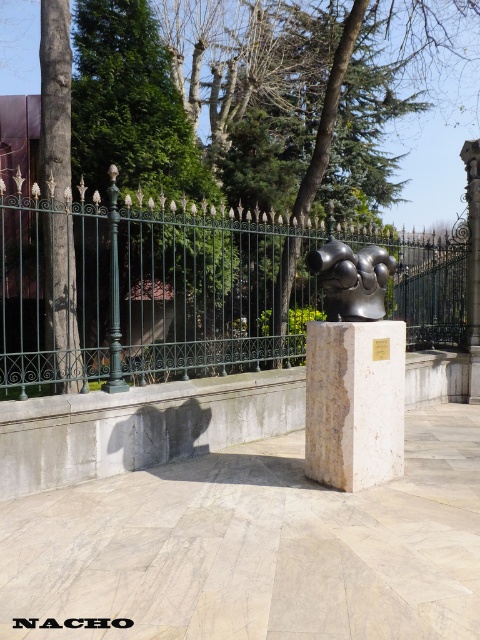
Looking at this image, which of these two, green wrought iron fence at center or white marble pillar at center, stands taller?

Standing taller between the two is white marble pillar at center.

How distant is green wrought iron fence at center from white marble pillar at center?

The distance of green wrought iron fence at center from white marble pillar at center is 1.73 meters.

Is point (192, 326) less distant than point (333, 337)?

No, it is not.

Image resolution: width=480 pixels, height=640 pixels. I want to click on green wrought iron fence at center, so click(149, 292).

Can you confirm if green wrought iron fence at center is wider than smooth bark tree at left?

Correct, the width of green wrought iron fence at center exceeds that of smooth bark tree at left.

Can you confirm if green wrought iron fence at center is positioned to the left of smooth bark tree at left?

No, green wrought iron fence at center is not to the left of smooth bark tree at left.

Between point (292, 323) and point (68, 342), which one is positioned in front?

Point (68, 342) is more forward.

Find the location of a particular element. The height and width of the screenshot is (640, 480). green wrought iron fence at center is located at coordinates (149, 292).

Is white marble pillar at center above smooth bark tree at left?

Actually, white marble pillar at center is below smooth bark tree at left.

How much distance is there between white marble pillar at center and smooth bark tree at left?

white marble pillar at center is 8.04 feet from smooth bark tree at left.

Between point (377, 340) and point (66, 51), which one is positioned behind?

The point (66, 51) is behind.

Find the location of a particular element. The height and width of the screenshot is (640, 480). white marble pillar at center is located at coordinates (355, 403).